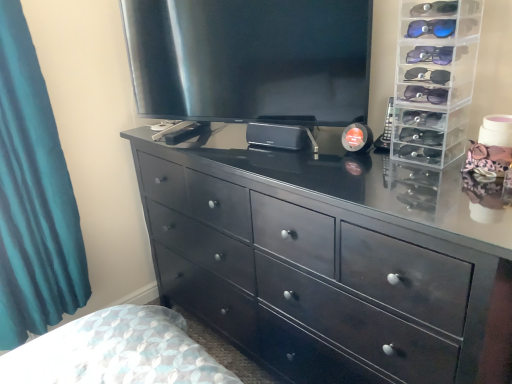
Question: Is black wood chest of drawers at center inside the boundaries of clear plastic sunglasses organizer at right, or outside?

Choices:
 (A) outside
 (B) inside

Answer: (A)

Question: Is black wood chest of drawers at center bigger or smaller than clear plastic sunglasses organizer at right?

Choices:
 (A) big
 (B) small

Answer: (A)

Question: Which is farther from the teal fabric curtain at left?

Choices:
 (A) black wood chest of drawers at center
 (B) satin black tv at upper center
 (C) clear plastic sunglasses organizer at right

Answer: (C)

Question: Considering the real-world distances, which object is closest to the black wood chest of drawers at center?

Choices:
 (A) satin black tv at upper center
 (B) clear plastic sunglasses organizer at right
 (C) teal fabric curtain at left

Answer: (A)